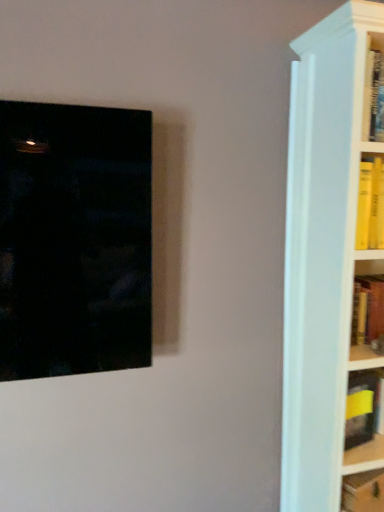
Identify the location of matte black picture frame at left. This screenshot has height=512, width=384. (74, 239).

This screenshot has width=384, height=512. What do you see at coordinates (74, 239) in the screenshot? I see `matte black picture frame at left` at bounding box center [74, 239].

What are the coordinates of `yellow hardcover book at lower right, which appears as the 2th book when viewed from the top` in the screenshot? It's located at (363, 492).

Considering the relative positions of yellow matte book at right, which is the first book from top to bottom, and matte black picture frame at left in the image provided, is yellow matte book at right, which is the first book from top to bottom, behind matte black picture frame at left?

That is True.

Does yellow matte book at right, which is the first book from top to bottom, have a greater width compared to matte black picture frame at left?

No, yellow matte book at right, which is the first book from top to bottom, is not wider than matte black picture frame at left.

From the image's perspective, is yellow matte book at right, marked as the second book in a bottom-to-top arrangement, under matte black picture frame at left?

Yes, from the image's perspective, yellow matte book at right, marked as the second book in a bottom-to-top arrangement, is beneath matte black picture frame at left.

Is yellow matte book at right, which is the first book from top to bottom, at the left side of matte black picture frame at left?

No.

Between matte black picture frame at left and yellow hardcover book at lower right, the first book from the bottom, which one has smaller size?

yellow hardcover book at lower right, the first book from the bottom, is smaller.

Locate an element on the screen. The image size is (384, 512). picture frame in front of the yellow hardcover book at lower right, which appears as the 2th book when viewed from the top is located at coordinates (74, 239).

From a real-world perspective, which object stands above the other?

matte black picture frame at left is physically above.

Is point (354, 425) farther from camera compared to point (344, 508)?

That is True.

Could you measure the distance between yellow matte book at right, marked as the second book in a bottom-to-top arrangement, and yellow hardcover book at lower right, the first book from the bottom?

The distance of yellow matte book at right, marked as the second book in a bottom-to-top arrangement, from yellow hardcover book at lower right, the first book from the bottom, is 6.94 inches.

Is yellow matte book at right, which is the first book from top to bottom, next to yellow hardcover book at lower right, which appears as the 2th book when viewed from the top, and touching it?

No, yellow matte book at right, which is the first book from top to bottom, is not next to yellow hardcover book at lower right, which appears as the 2th book when viewed from the top.

This screenshot has width=384, height=512. Find the location of `book lying on the right of yellow matte book at right, which is the first book from top to bottom`. book lying on the right of yellow matte book at right, which is the first book from top to bottom is located at coordinates (363, 492).

Which of these two, yellow hardcover book at lower right, the first book from the bottom, or matte black picture frame at left, is smaller?

With smaller size is yellow hardcover book at lower right, the first book from the bottom.

Is yellow hardcover book at lower right, which appears as the 2th book when viewed from the top, not inside matte black picture frame at left?

Yes, yellow hardcover book at lower right, which appears as the 2th book when viewed from the top, is outside of matte black picture frame at left.

Can you confirm if yellow hardcover book at lower right, which appears as the 2th book when viewed from the top, is shorter than matte black picture frame at left?

Yes, yellow hardcover book at lower right, which appears as the 2th book when viewed from the top, is shorter than matte black picture frame at left.

Could you tell me if matte black picture frame at left is facing yellow matte book at right, marked as the second book in a bottom-to-top arrangement?

No, matte black picture frame at left is not oriented towards yellow matte book at right, marked as the second book in a bottom-to-top arrangement.

Would you say yellow matte book at right, marked as the second book in a bottom-to-top arrangement, is part of matte black picture frame at left's contents?

No, matte black picture frame at left does not contain yellow matte book at right, marked as the second book in a bottom-to-top arrangement.

What's the angular difference between matte black picture frame at left and yellow matte book at right, marked as the second book in a bottom-to-top arrangement,'s facing directions?

They differ by 0.734 degrees in their facing directions.

Is matte black picture frame at left thinner than yellow matte book at right, marked as the second book in a bottom-to-top arrangement?

No.

Relative to yellow matte book at right, which is the first book from top to bottom, is yellow hardcover book at lower right, which appears as the 2th book when viewed from the top, in front or behind?

Clearly, yellow hardcover book at lower right, which appears as the 2th book when viewed from the top, is in front of yellow matte book at right, which is the first book from top to bottom.

Can you tell me how much yellow hardcover book at lower right, which appears as the 2th book when viewed from the top, and yellow matte book at right, marked as the second book in a bottom-to-top arrangement, differ in facing direction?

36.6 degrees.

Can we say yellow hardcover book at lower right, which appears as the 2th book when viewed from the top, lies outside yellow matte book at right, marked as the second book in a bottom-to-top arrangement?

Absolutely, yellow hardcover book at lower right, which appears as the 2th book when viewed from the top, is external to yellow matte book at right, marked as the second book in a bottom-to-top arrangement.

Looking at their sizes, would you say yellow hardcover book at lower right, the first book from the bottom, is wider or thinner than yellow matte book at right, marked as the second book in a bottom-to-top arrangement?

yellow hardcover book at lower right, the first book from the bottom, is wider than yellow matte book at right, marked as the second book in a bottom-to-top arrangement.

Find the location of a particular element. picture frame located above the yellow matte book at right, which is the first book from top to bottom (from a real-world perspective) is located at coordinates (74, 239).

The width and height of the screenshot is (384, 512). I want to click on picture frame in front of the yellow hardcover book at lower right, the first book from the bottom, so click(x=74, y=239).

Estimate the real-world distances between objects in this image. Which object is further from matte black picture frame at left, yellow hardcover book at lower right, which appears as the 2th book when viewed from the top, or yellow matte book at right, marked as the second book in a bottom-to-top arrangement?

yellow hardcover book at lower right, which appears as the 2th book when viewed from the top, lies further to matte black picture frame at left than the other object.

Which object lies further to the anchor point yellow matte book at right, marked as the second book in a bottom-to-top arrangement, yellow hardcover book at lower right, which appears as the 2th book when viewed from the top, or matte black picture frame at left?

matte black picture frame at left is positioned further to the anchor yellow matte book at right, marked as the second book in a bottom-to-top arrangement.

When comparing their distances from yellow hardcover book at lower right, which appears as the 2th book when viewed from the top, does matte black picture frame at left or yellow matte book at right, which is the first book from top to bottom, seem closer?

yellow matte book at right, which is the first book from top to bottom, is positioned closer to the anchor yellow hardcover book at lower right, which appears as the 2th book when viewed from the top.

Looking at the image, which one is located closer to yellow hardcover book at lower right, the first book from the bottom, yellow matte book at right, marked as the second book in a bottom-to-top arrangement, or matte black picture frame at left?

Based on the image, yellow matte book at right, marked as the second book in a bottom-to-top arrangement, appears to be nearer to yellow hardcover book at lower right, the first book from the bottom.

Based on the photo, looking at the image, which one is located further to matte black picture frame at left, yellow matte book at right, marked as the second book in a bottom-to-top arrangement, or yellow hardcover book at lower right, the first book from the bottom?

Based on the image, yellow hardcover book at lower right, the first book from the bottom, appears to be further to matte black picture frame at left.

When comparing their distances from yellow matte book at right, marked as the second book in a bottom-to-top arrangement, does matte black picture frame at left or yellow hardcover book at lower right, which appears as the 2th book when viewed from the top, seem closer?

Based on the image, yellow hardcover book at lower right, which appears as the 2th book when viewed from the top, appears to be nearer to yellow matte book at right, marked as the second book in a bottom-to-top arrangement.

This screenshot has height=512, width=384. In order to click on book between matte black picture frame at left and yellow hardcover book at lower right, which appears as the 2th book when viewed from the top in this screenshot , I will do `click(361, 407)`.